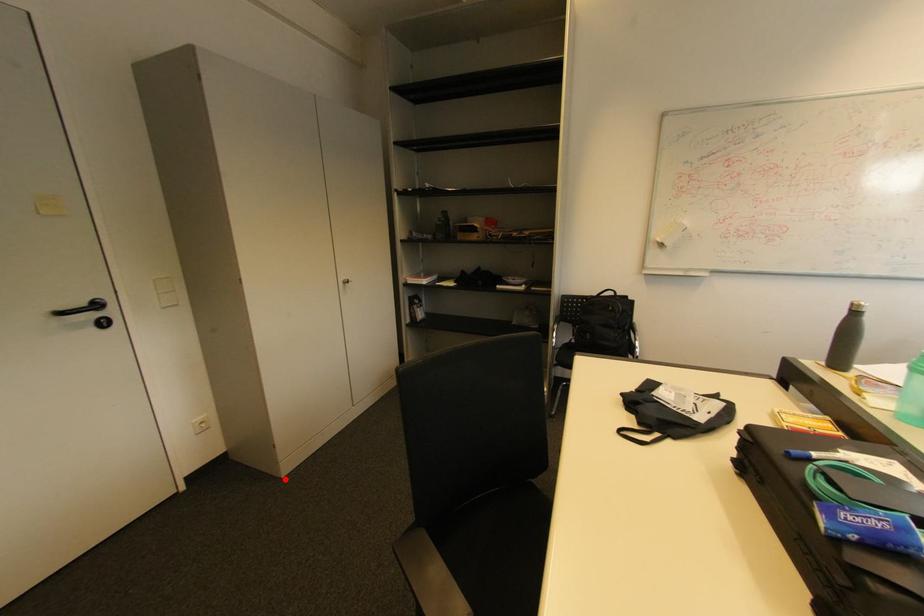
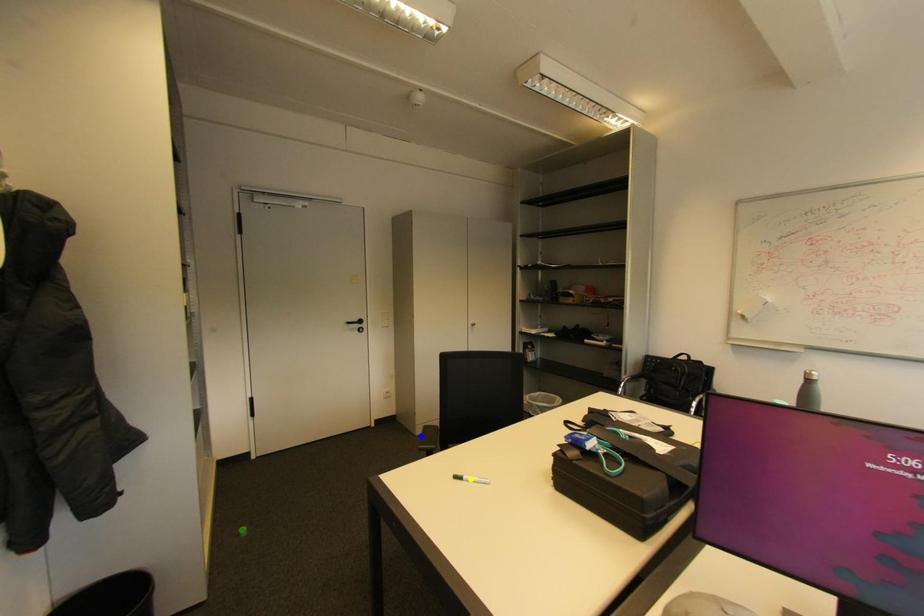
Question: I am providing you with two images of the same scene from different viewpoints. A red point is marked on the first image. You are given multiple points on the second image. Which point in image 2 is actually the same real-world point as the red point in image 1?

Choices:
 (A) green point
 (B) yellow point
 (C) blue point

Answer: (C)